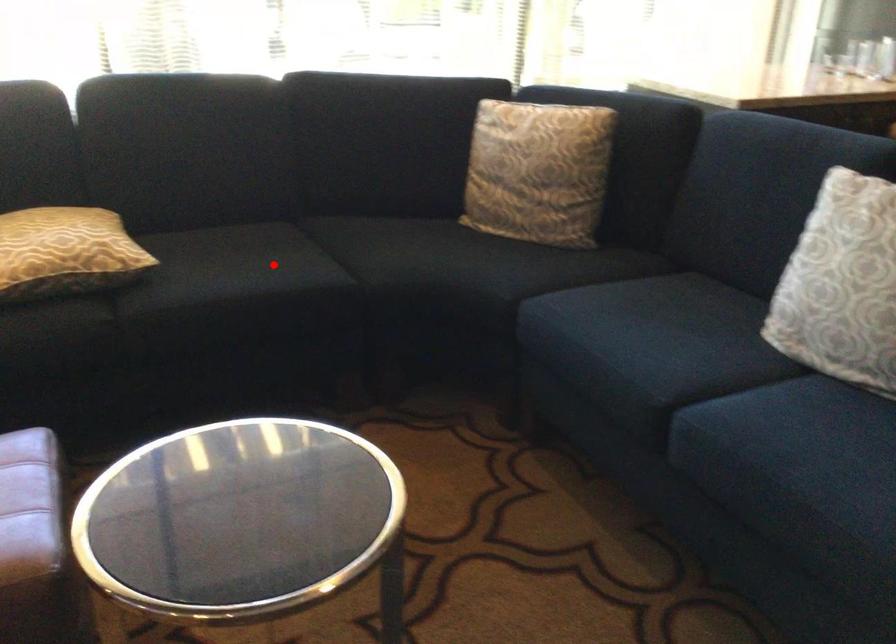
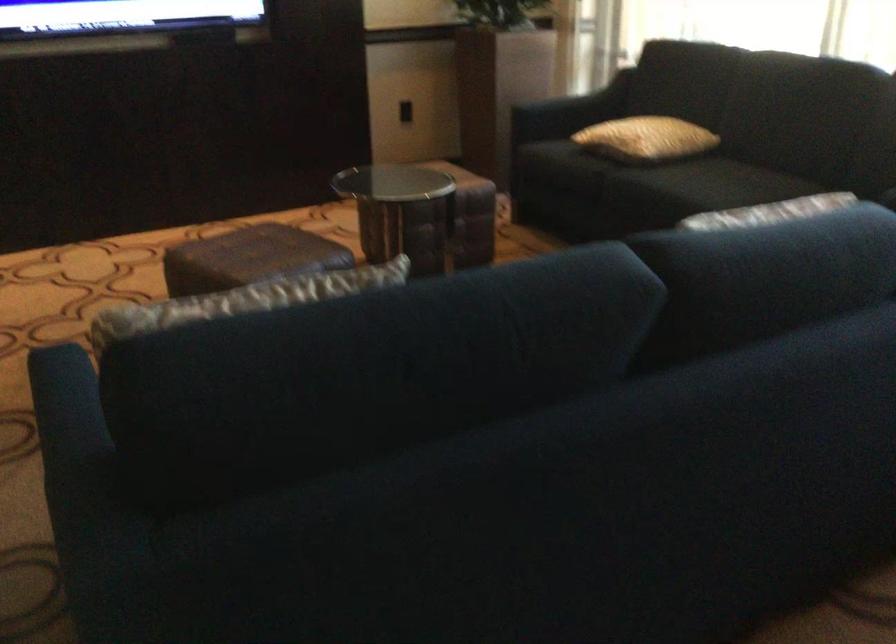
Question: I am providing you with two images of the same scene from different viewpoints. Given a red point in image1, look at the same physical point in image2. Is it:

Choices:
 (A) Closer to the viewpoint
 (B) Farther from the viewpoint

Answer: (B)